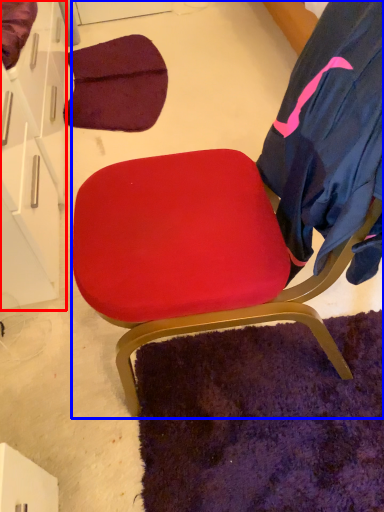
Question: Which point is closer to the camera, drawer (highlighted by a red box) or chair (highlighted by a blue box)?

Choices:
 (A) drawer
 (B) chair

Answer: (B)